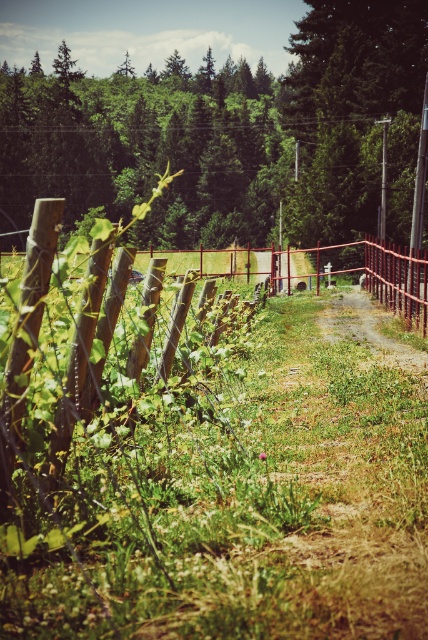
Question: Which point is closer to the camera?

Choices:
 (A) brown dirt track at center
 (B) green grass at lower left

Answer: (B)

Question: Is green leafy tree at upper center behind brown dirt track at center?

Choices:
 (A) no
 (B) yes

Answer: (B)

Question: Which point is closer to the camera?

Choices:
 (A) (74, 528)
 (B) (368, 308)
 (C) (143, 74)

Answer: (A)

Question: In this image, where is green leafy tree at upper center located relative to brown dirt track at center?

Choices:
 (A) above
 (B) below

Answer: (A)

Question: Can you confirm if green leafy tree at upper center is bigger than brown dirt track at center?

Choices:
 (A) yes
 (B) no

Answer: (A)

Question: Among these objects, which one is farthest from the camera?

Choices:
 (A) brown dirt track at center
 (B) green grass at lower left

Answer: (A)